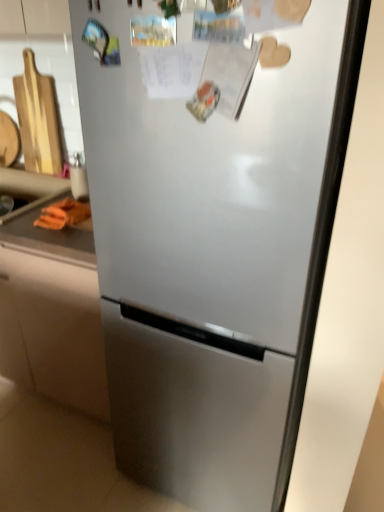
Question: Looking at the image, does orange rubber at lower left seem bigger or smaller compared to orange fabric at left?

Choices:
 (A) small
 (B) big

Answer: (B)

Question: Is orange rubber at lower left spatially inside orange fabric at left, or outside of it?

Choices:
 (A) outside
 (B) inside

Answer: (A)

Question: Which object is positioned closest to the orange rubber at lower left?

Choices:
 (A) orange fabric at left
 (B) orange fabric at left

Answer: (B)

Question: Estimate the real-world distances between objects in this image. Which object is farther from the orange fabric at left?

Choices:
 (A) orange rubber at lower left
 (B) orange fabric at left

Answer: (A)